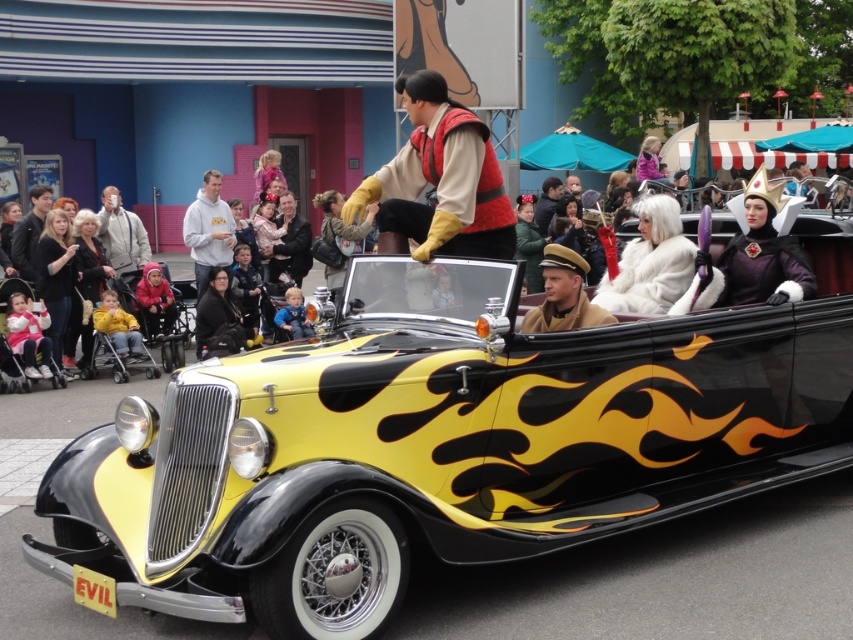
Question: Among these points, which one is nearest to the camera?

Choices:
 (A) (x=550, y=326)
 (B) (x=97, y=326)
 (C) (x=164, y=310)
 (D) (x=218, y=177)

Answer: (A)

Question: Does pink fleece jacket at lower left appear under yellow fleece jacket at lower left?

Choices:
 (A) yes
 (B) no

Answer: (B)

Question: Can you confirm if shiny purple crown at upper right is positioned above white fur coat at center?

Choices:
 (A) no
 (B) yes

Answer: (B)

Question: Which object appears closest to the camera in this image?

Choices:
 (A) yellow fleece jacket at lower left
 (B) shiny purple crown at upper right

Answer: (B)

Question: Which point is closer to the camera?

Choices:
 (A) (35, 376)
 (B) (646, 276)
 (C) (763, 177)
 (D) (167, 307)

Answer: (B)

Question: Can you confirm if yellow glossy car at center is smaller than black fur coat at center?

Choices:
 (A) no
 (B) yes

Answer: (A)